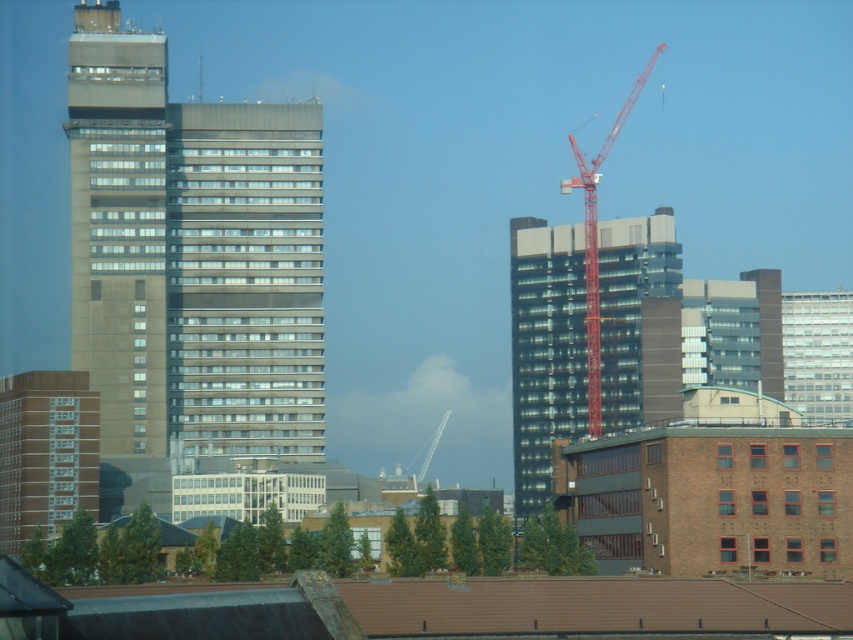
Question: Is glassy black building at center below red metal crane at upper right?

Choices:
 (A) yes
 (B) no

Answer: (A)

Question: Does concrete building at left come in front of glassy black building at center?

Choices:
 (A) yes
 (B) no

Answer: (A)

Question: Among these points, which one is farthest from the camera?

Choices:
 (A) 589,237
 (B) 80,448

Answer: (A)

Question: Which object appears closest to the camera in this image?

Choices:
 (A) red metal crane at upper right
 (B) brown brick building at lower left
 (C) glassy black building at center

Answer: (B)

Question: Is brown brick building at lower left positioned before red metal crane at upper right?

Choices:
 (A) no
 (B) yes

Answer: (B)

Question: Considering the real-world distances, which object is farthest from the red metal crane at upper right?

Choices:
 (A) glassy black building at center
 (B) concrete building at left

Answer: (B)